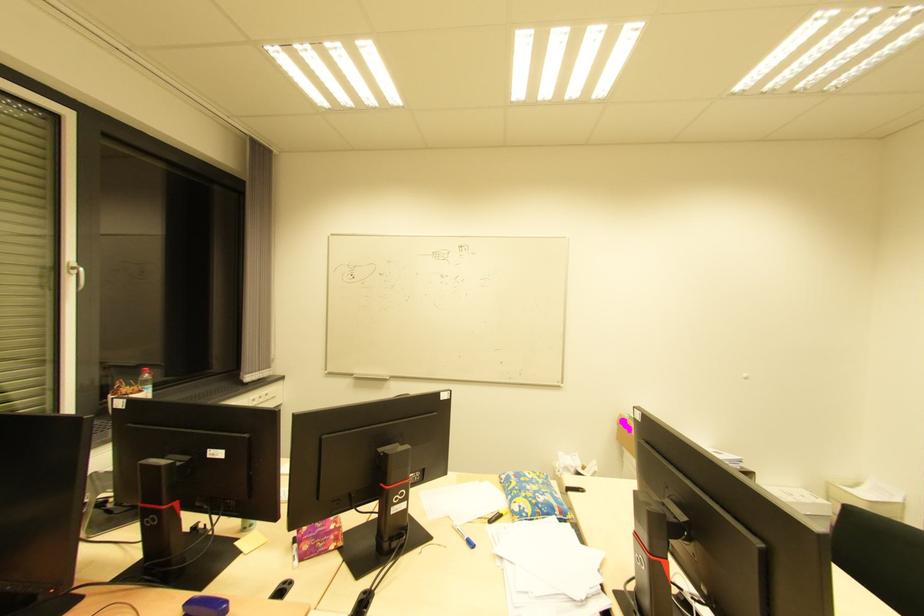
What are the coordinates of `white window handle` in the screenshot? It's located at (77, 275).